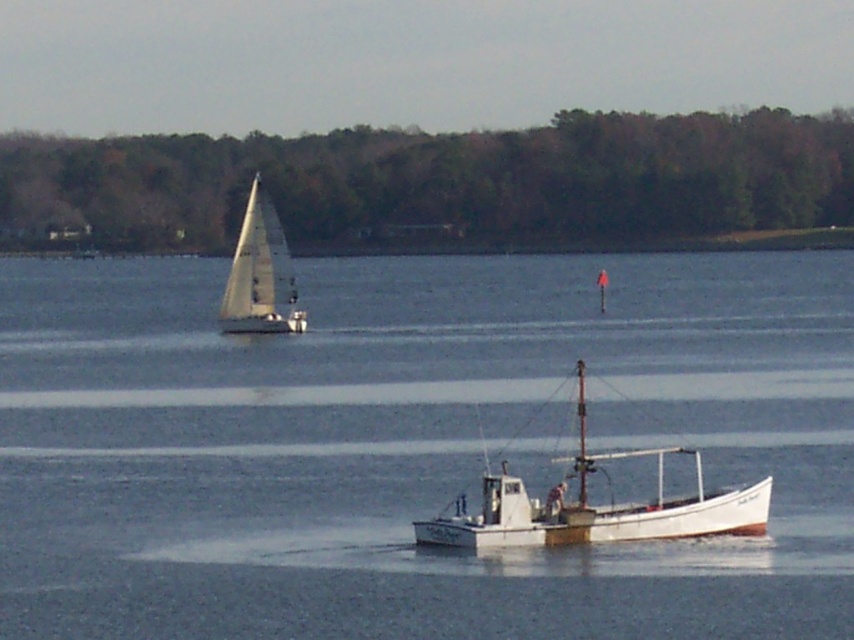
You are a photographer planning to capture the entire white wooden boat at center in your shot. Given that the white matte water at center takes up more space in the frame than the boat, will you need to adjust your camera angle to ensure the boat fits entirely within the photo?

Yes, you need to adjust your camera angle because the white matte water at center is wider than the white wooden boat at center, so the boat may not fit entirely within the photo if the water occupies more space.

Based on the photo, you are a sailor navigating a small boat and you see the white matte water at center and the white sailboat at upper left. Which object is located to the right of the other?

The white matte water at center is positioned on the right side of white sailboat at upper left, so the white matte water at center is to the right of the white sailboat at upper left.

You are standing on the dock and see the white matte water at center and the white wooden boat at center in the water. Which one takes up more space in the image?

The white matte water at center is larger in size than the white wooden boat at center, so it takes up more space in the image.